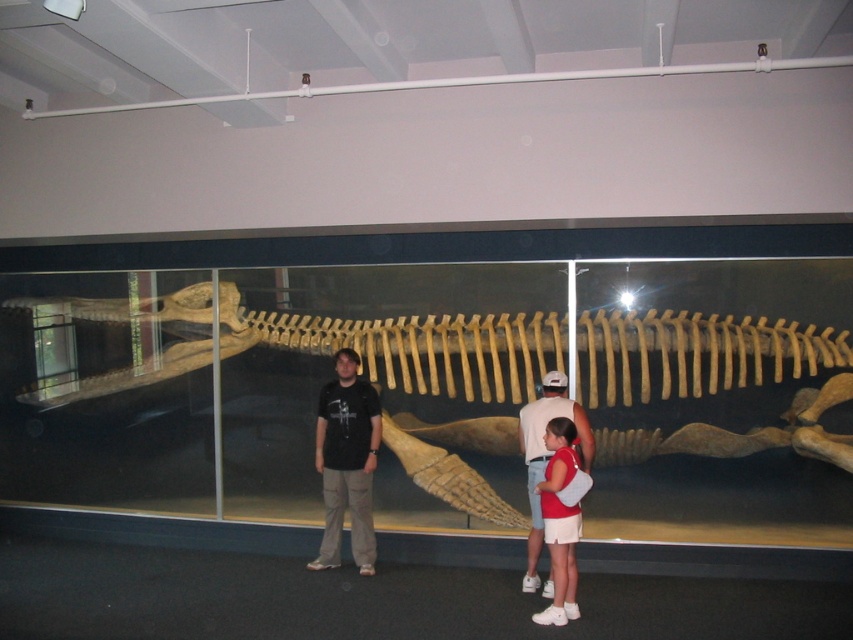
Question: Which point is farther to the camera?

Choices:
 (A) (344, 461)
 (B) (193, 513)

Answer: (B)

Question: Among these objects, which one is farthest from the camera?

Choices:
 (A) white cotton shirt at center
 (B) matte black t-shirt at center

Answer: (B)

Question: Which of these objects is positioned closest to the white cotton shirt at center?

Choices:
 (A) matte black t-shirt at center
 (B) bone-like skeleton at center

Answer: (A)

Question: Can you confirm if bone-like skeleton at center is positioned above white cotton shirt at center?

Choices:
 (A) no
 (B) yes

Answer: (B)

Question: In this image, where is bone-like skeleton at center located relative to white cotton shirt at center?

Choices:
 (A) below
 (B) above

Answer: (B)

Question: In this image, where is matte black t-shirt at center located relative to white cotton shirt at center?

Choices:
 (A) right
 (B) left

Answer: (B)